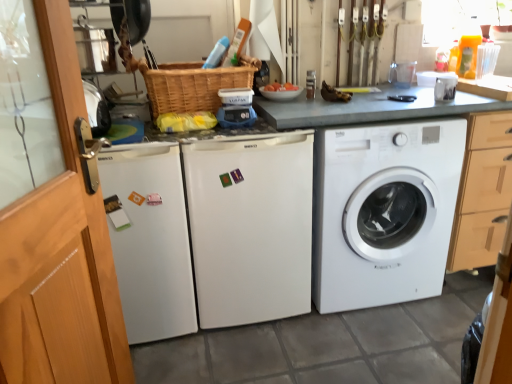
Locate an element on the screen. wooden screen door at left, acting as the first screen door starting from the left is located at coordinates (48, 290).

What do you see at coordinates (48, 290) in the screenshot?
I see `wooden screen door at left, placed as the 2th screen door when sorted from right to left` at bounding box center [48, 290].

What do you see at coordinates (445, 88) in the screenshot? I see `white glossy mug at upper right` at bounding box center [445, 88].

Identify the location of white glossy mug at upper right. (445, 88).

What are the coordinates of `white matte washing machine at center, which is the 1th washing machine in left-to-right order` in the screenshot? It's located at [149, 239].

The image size is (512, 384). Find the location of `white matte washing machine at center, the 1th washing machine from the right`. white matte washing machine at center, the 1th washing machine from the right is located at coordinates (383, 211).

Find the location of a particular element. The height and width of the screenshot is (384, 512). wooden screen door at left, acting as the first screen door starting from the left is located at coordinates (48, 290).

Is white matte washing machine at center, arranged as the third washing machine when viewed from the right, bigger or smaller than white matte washing machine at center, the 3th washing machine viewed from the left?

Clearly, white matte washing machine at center, arranged as the third washing machine when viewed from the right, is smaller in size than white matte washing machine at center, the 3th washing machine viewed from the left.

Is the depth of white matte washing machine at center, arranged as the third washing machine when viewed from the right, less than that of white matte washing machine at center, the 1th washing machine from the right?

Yes.

What's the angular difference between white matte washing machine at center, arranged as the third washing machine when viewed from the right, and white matte washing machine at center, the 3th washing machine viewed from the left,'s facing directions?

The angle between the facing direction of white matte washing machine at center, arranged as the third washing machine when viewed from the right, and the facing direction of white matte washing machine at center, the 3th washing machine viewed from the left, is 1.27 degrees.

Is wooden screen door at left, placed as the 2th screen door when sorted from right to left, to the right of white matte washing machine at center, the 1th washing machine from the right, from the viewer's perspective?

In fact, wooden screen door at left, placed as the 2th screen door when sorted from right to left, is to the left of white matte washing machine at center, the 1th washing machine from the right.

Which of these two, wooden screen door at left, placed as the 2th screen door when sorted from right to left, or white matte washing machine at center, the 3th washing machine viewed from the left, is wider?

white matte washing machine at center, the 3th washing machine viewed from the left, is wider.

From a real-world perspective, relative to white matte washing machine at center, the 3th washing machine viewed from the left, is wooden screen door at left, acting as the first screen door starting from the left, vertically above or below?

From a real-world perspective, wooden screen door at left, acting as the first screen door starting from the left, is physically above white matte washing machine at center, the 3th washing machine viewed from the left.

Which of these two, woven brown basket at center or wooden screen door at left, placed as the 2th screen door when sorted from right to left, is bigger?

Bigger between the two is woven brown basket at center.

At what (x,y) coordinates should I click in order to perform the action: click on basket above the wooden screen door at left, acting as the first screen door starting from the left (from a real-world perspective). Please return your answer as a coordinate pair (x, y). Looking at the image, I should click on (192, 84).

Is point (175, 108) closer to camera compared to point (52, 306)?

That is False.

Relative to wooden screen door at left, acting as the first screen door starting from the left, is woven brown basket at center in front or behind?

Clearly, woven brown basket at center is behind wooden screen door at left, acting as the first screen door starting from the left.

From a real-world perspective, is white glossy mug at upper right located higher than white matte refrigerator at center, marked as the 2th washing machine in a left-to-right arrangement?

Yes, from a real-world perspective, white glossy mug at upper right is on top of white matte refrigerator at center, marked as the 2th washing machine in a left-to-right arrangement.

Who is bigger, white glossy mug at upper right or white matte refrigerator at center, marked as the 2th washing machine in a left-to-right arrangement?

white matte refrigerator at center, marked as the 2th washing machine in a left-to-right arrangement.

Is the depth of white glossy mug at upper right less than that of white matte refrigerator at center, marked as the 2th washing machine in a left-to-right arrangement?

That is False.

Which of these two, white glossy mug at upper right or white matte refrigerator at center, which is the 2th washing machine from right to left, stands taller?

Standing taller between the two is white matte refrigerator at center, which is the 2th washing machine from right to left.

Consider the image. Considering the positions of objects white matte washing machine at center, arranged as the third washing machine when viewed from the right, and wooden screen door at left, acting as the first screen door starting from the left, in the image provided, who is more to the left, white matte washing machine at center, arranged as the third washing machine when viewed from the right, or wooden screen door at left, acting as the first screen door starting from the left,?

white matte washing machine at center, arranged as the third washing machine when viewed from the right, is more to the left.

Based on the photo, considering the sizes of objects white matte washing machine at center, arranged as the third washing machine when viewed from the right, and wooden screen door at left, acting as the first screen door starting from the left, in the image provided, who is smaller, white matte washing machine at center, arranged as the third washing machine when viewed from the right, or wooden screen door at left, acting as the first screen door starting from the left,?

Smaller between the two is wooden screen door at left, acting as the first screen door starting from the left.

Can you see white matte washing machine at center, arranged as the third washing machine when viewed from the right, touching wooden screen door at left, placed as the 2th screen door when sorted from right to left?

No.

Considering the positions of points (122, 290) and (48, 220), is point (122, 290) closer to camera compared to point (48, 220)?

No.

Can you confirm if white glossy mug at upper right is smaller than white matte washing machine at center, the 3th washing machine viewed from the left?

Correct, white glossy mug at upper right occupies less space than white matte washing machine at center, the 3th washing machine viewed from the left.

Which of these two, white glossy mug at upper right or white matte washing machine at center, the 3th washing machine viewed from the left, stands shorter?

white glossy mug at upper right.

What's the angular difference between white glossy mug at upper right and white matte washing machine at center, the 1th washing machine from the right,'s facing directions?

They differ by 113 degrees in their facing directions.

Is white glossy mug at upper right aimed at white matte washing machine at center, the 1th washing machine from the right?

No, white glossy mug at upper right is not turned towards white matte washing machine at center, the 1th washing machine from the right.

Which of these two, woven brown basket at center or white glossy mug at upper right, is wider?

Wider between the two is woven brown basket at center.

Can you confirm if woven brown basket at center is shorter than white glossy mug at upper right?

No, woven brown basket at center is not shorter than white glossy mug at upper right.

Which object is further away from the camera taking this photo, woven brown basket at center or white glossy mug at upper right?

white glossy mug at upper right is behind.

Starting from the white matte washing machine at center, arranged as the third washing machine when viewed from the right, which washing machine is the 2nd one behind? Please provide its 2D coordinates.

[(383, 211)]

You are a GUI agent. You are given a task and a screenshot of the screen. Output one action in this format:
    pyautogui.click(x=<x>, y=<y>)
    Task: Click on the 1st screen door in front of the white matte washing machine at center, the 3th washing machine viewed from the left, counting from the anchor's position
    The width and height of the screenshot is (512, 384).
    Given the screenshot: What is the action you would take?
    pyautogui.click(x=48, y=290)

Which object lies further to the anchor point white matte washing machine at center, arranged as the third washing machine when viewed from the right, transparent glass screen door at left, which is the 1th screen door in right-to-left order, or white glossy mug at upper right?

The object further to white matte washing machine at center, arranged as the third washing machine when viewed from the right, is white glossy mug at upper right.

Considering their positions, is wooden screen door at left, placed as the 2th screen door when sorted from right to left, positioned further to white matte washing machine at center, the 1th washing machine from the right, than transparent glass screen door at left, the second screen door viewed from the left?

The object further to white matte washing machine at center, the 1th washing machine from the right, is wooden screen door at left, placed as the 2th screen door when sorted from right to left.

From the image, which object appears to be farther from white matte washing machine at center, the 3th washing machine viewed from the left, transparent glass screen door at left, the second screen door viewed from the left, or wooden screen door at left, placed as the 2th screen door when sorted from right to left?

wooden screen door at left, placed as the 2th screen door when sorted from right to left, lies further to white matte washing machine at center, the 3th washing machine viewed from the left, than the other object.

Looking at the image, which one is located closer to white matte washing machine at center, which is the 1th washing machine in left-to-right order, white matte washing machine at center, the 3th washing machine viewed from the left, or wooden screen door at left, acting as the first screen door starting from the left?

wooden screen door at left, acting as the first screen door starting from the left, is positioned closer to the anchor white matte washing machine at center, which is the 1th washing machine in left-to-right order.

Based on the photo, based on their spatial positions, is white matte washing machine at center, arranged as the third washing machine when viewed from the right, or wooden screen door at left, acting as the first screen door starting from the left, further from white glossy mug at upper right?

wooden screen door at left, acting as the first screen door starting from the left, is further to white glossy mug at upper right.

From the image, which object appears to be farther from woven brown basket at center, white matte washing machine at center, which is the 1th washing machine in left-to-right order, or transparent glass screen door at left, the second screen door viewed from the left?

The object further to woven brown basket at center is transparent glass screen door at left, the second screen door viewed from the left.

When comparing their distances from white matte washing machine at center, the 3th washing machine viewed from the left, does white glossy mug at upper right or woven brown basket at center seem further?

woven brown basket at center is positioned further to the anchor white matte washing machine at center, the 3th washing machine viewed from the left.

Which object lies nearer to the anchor point transparent glass screen door at left, the second screen door viewed from the left, white matte washing machine at center, arranged as the third washing machine when viewed from the right, or white glossy mug at upper right?

Among the two, white matte washing machine at center, arranged as the third washing machine when viewed from the right, is located nearer to transparent glass screen door at left, the second screen door viewed from the left.

What are the coordinates of `washing machine between wooden screen door at left, acting as the first screen door starting from the left, and white matte refrigerator at center, which is the 2th washing machine from right to left, along the z-axis` in the screenshot? It's located at (149, 239).

This screenshot has height=384, width=512. Identify the location of basket between white matte washing machine at center, arranged as the third washing machine when viewed from the right, and white matte washing machine at center, the 3th washing machine viewed from the left, in the horizontal direction. click(x=192, y=84).

Where is `washing machine between transparent glass screen door at left, which is the 1th screen door in right-to-left order, and white matte refrigerator at center, marked as the 2th washing machine in a left-to-right arrangement, in the front-back direction`? The image size is (512, 384). washing machine between transparent glass screen door at left, which is the 1th screen door in right-to-left order, and white matte refrigerator at center, marked as the 2th washing machine in a left-to-right arrangement, in the front-back direction is located at coordinates (149, 239).

Find the location of a particular element. screen door between transparent glass screen door at left, which is the 1th screen door in right-to-left order, and woven brown basket at center, along the z-axis is located at coordinates (48, 290).